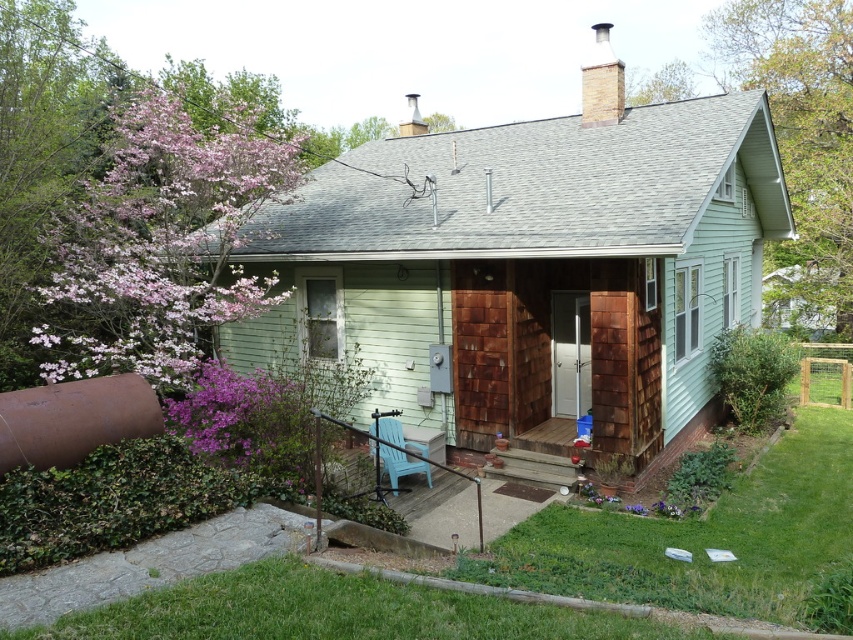
Is pink bloom at upper left to the left of rustic wood porch at lower center from the viewer's perspective?

Correct, you'll find pink bloom at upper left to the left of rustic wood porch at lower center.

Which of these two, pink bloom at upper left or rustic wood porch at lower center, stands shorter?

rustic wood porch at lower center

Which is in front, point (173, 154) or point (486, 529)?

Positioned in front is point (486, 529).

This screenshot has width=853, height=640. Identify the location of pink bloom at upper left. (158, 246).

Between light green siding at center and pink bloom at upper left, which one appears on the right side from the viewer's perspective?

Positioned to the right is light green siding at center.

Where is `light green siding at center`? This screenshot has height=640, width=853. light green siding at center is located at coordinates (532, 268).

Measure the distance between point (498, 154) and camera.

Point (498, 154) is 44.68 feet away from camera.

Does point (457, 250) come behind point (380, 436)?

No, (457, 250) is closer to viewer.

Does point (492, 396) lie behind point (469, 532)?

Yes, point (492, 396) is farther from viewer.

The width and height of the screenshot is (853, 640). In order to click on light green siding at center in this screenshot , I will do `click(532, 268)`.